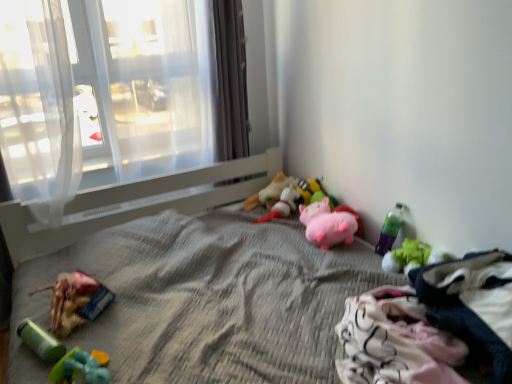
Question: Would you say soft plush toy at center, which is the 5th toy in left-to-right order, contains green plastic bottle at lower right, the 2th toy positioned from the right?

Choices:
 (A) no
 (B) yes

Answer: (A)

Question: From the image's perspective, is soft plush toy at center, which is the 5th toy in left-to-right order, above green plastic bottle at lower right, which is the seventh toy in left-to-right order?

Choices:
 (A) yes
 (B) no

Answer: (A)

Question: Does soft plush toy at center, which is the 5th toy in left-to-right order, turn towards green plastic bottle at lower right, the 2th toy positioned from the right?

Choices:
 (A) no
 (B) yes

Answer: (A)

Question: Is soft plush toy at center, which is the 5th toy in left-to-right order, positioned behind green plastic bottle at lower right, the 2th toy positioned from the right?

Choices:
 (A) no
 (B) yes

Answer: (B)

Question: From the image's perspective, is soft plush toy at center, acting as the 4th toy starting from the right, under green plastic bottle at lower right, which is the seventh toy in left-to-right order?

Choices:
 (A) no
 (B) yes

Answer: (A)

Question: Considering the positions of point (70, 286) and point (380, 254), is point (70, 286) closer or farther from the camera than point (380, 254)?

Choices:
 (A) farther
 (B) closer

Answer: (B)

Question: Is rubberized plastic toy at lower left, the second toy positioned from the left, in front of or behind green plastic bottle at lower right, which is the seventh toy in left-to-right order, in the image?

Choices:
 (A) behind
 (B) front

Answer: (B)

Question: Considering the positions of rubberized plastic toy at lower left, the second toy positioned from the left, and green plastic bottle at lower right, the 2th toy positioned from the right, in the image, is rubberized plastic toy at lower left, the second toy positioned from the left, bigger or smaller than green plastic bottle at lower right, the 2th toy positioned from the right,?

Choices:
 (A) small
 (B) big

Answer: (B)

Question: From the image's perspective, relative to green plastic bottle at lower right, the 2th toy positioned from the right, is rubberized plastic toy at lower left, which is the 7th toy in right-to-left order, above or below?

Choices:
 (A) below
 (B) above

Answer: (A)

Question: Does point (62, 354) appear closer or farther from the camera than point (413, 258)?

Choices:
 (A) closer
 (B) farther

Answer: (A)

Question: Is green plastic toy at lower left, which ranks as the 1th toy in left-to-right order, taller or shorter than green plush toy at lower right, the 8th toy viewed from the left?

Choices:
 (A) short
 (B) tall

Answer: (A)

Question: Looking at their shapes, would you say green plastic toy at lower left, which ranks as the 1th toy in left-to-right order, is wider or thinner than green plush toy at lower right, the first toy in the right-to-left sequence?

Choices:
 (A) wide
 (B) thin

Answer: (A)

Question: In the image, is green plastic toy at lower left, positioned as the 8th toy in right-to-left order, positioned in front of or behind green plush toy at lower right, the 8th toy viewed from the left?

Choices:
 (A) front
 (B) behind

Answer: (A)

Question: Is point (406, 258) closer or farther from the camera than point (144, 8)?

Choices:
 (A) farther
 (B) closer

Answer: (B)

Question: From the image's perspective, is green plush toy at lower right, the first toy in the right-to-left sequence, located above or below translucent fabric at upper left?

Choices:
 (A) above
 (B) below

Answer: (B)